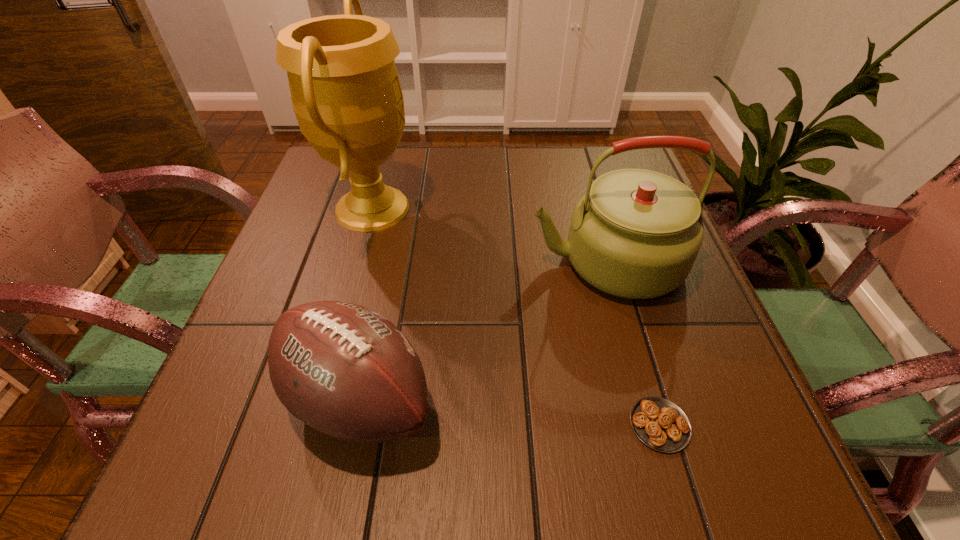
This screenshot has height=540, width=960. In order to click on vacant space at the far edge of the desktop in this screenshot , I will do `click(439, 152)`.

I want to click on vacant space at the near edge, so tap(443, 480).

Locate an element on the screen. This screenshot has width=960, height=540. free region at the right edge of the desktop is located at coordinates (686, 312).

Locate an element on the screen. The width and height of the screenshot is (960, 540). vacant region at the far left corner of the desktop is located at coordinates (325, 169).

I want to click on vacant space at the near left corner of the desktop, so click(x=224, y=451).

Locate an element on the screen. The image size is (960, 540). vacant space that's between the pastry and the tallest object is located at coordinates (516, 316).

Where is `vacant area between the second shortest object and the pastry`? Image resolution: width=960 pixels, height=540 pixels. vacant area between the second shortest object and the pastry is located at coordinates (509, 413).

Where is `free space that is in between the shortest object and the trophy`? The height and width of the screenshot is (540, 960). free space that is in between the shortest object and the trophy is located at coordinates (516, 316).

Locate an element on the screen. blank region between the tallest object and the football (American) is located at coordinates pos(366,304).

Identify the location of empty space between the football (American) and the second tallest object. (483, 331).